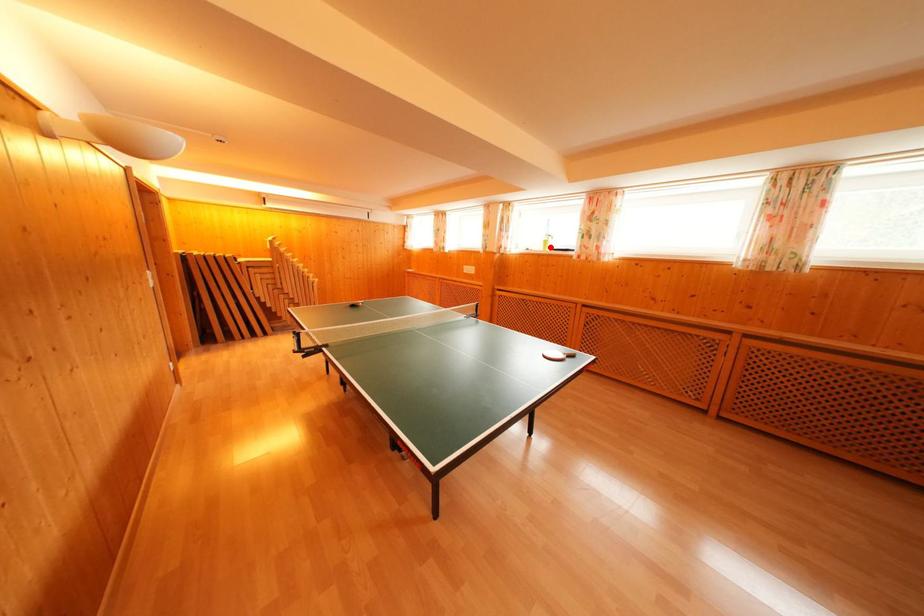
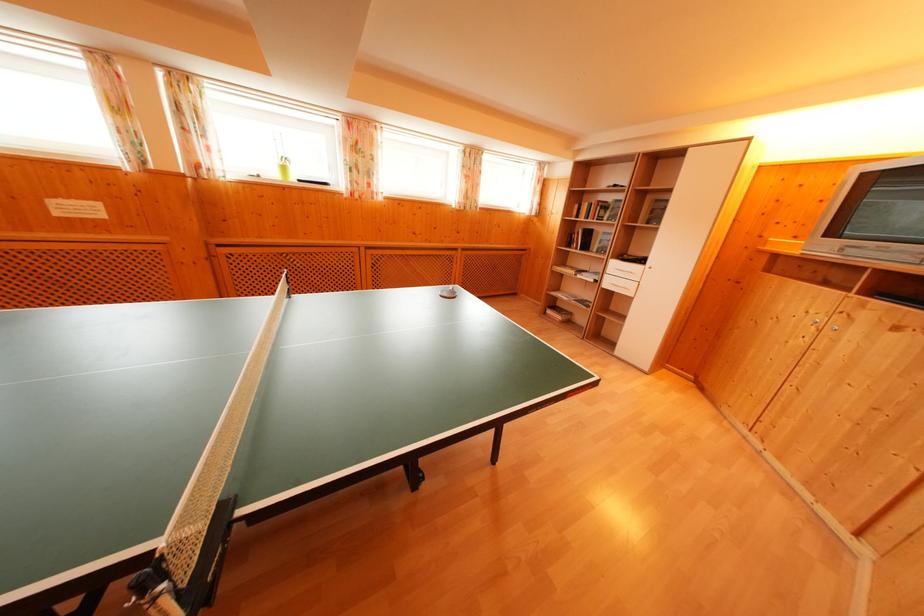
Find the pixel in the second image that matches the highlighted location in the first image.

(288, 174)